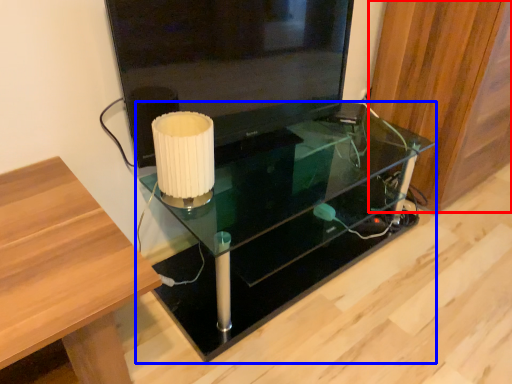
Question: Which object appears farthest to the camera in this image, wood (highlighted by a red box) or table (highlighted by a blue box)?

Choices:
 (A) wood
 (B) table

Answer: (A)